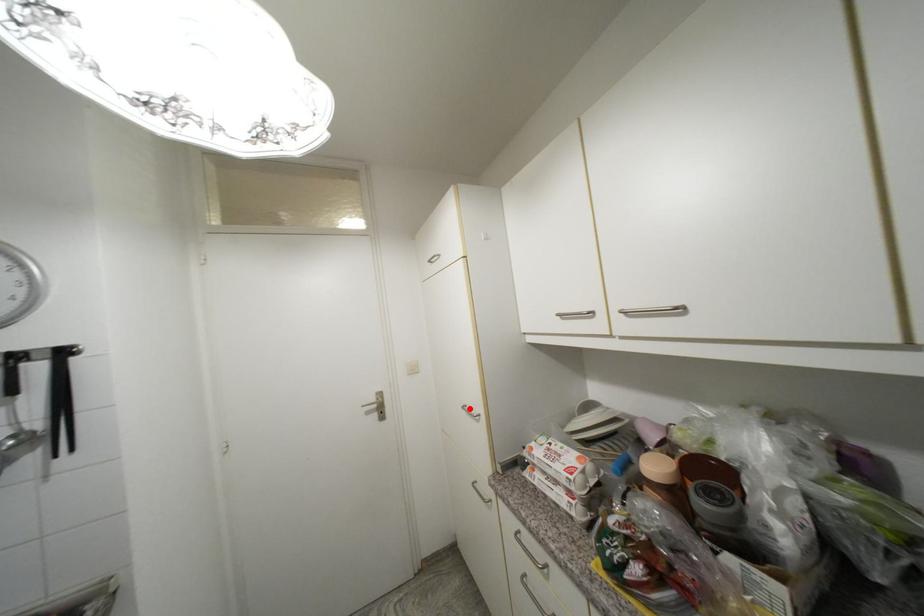
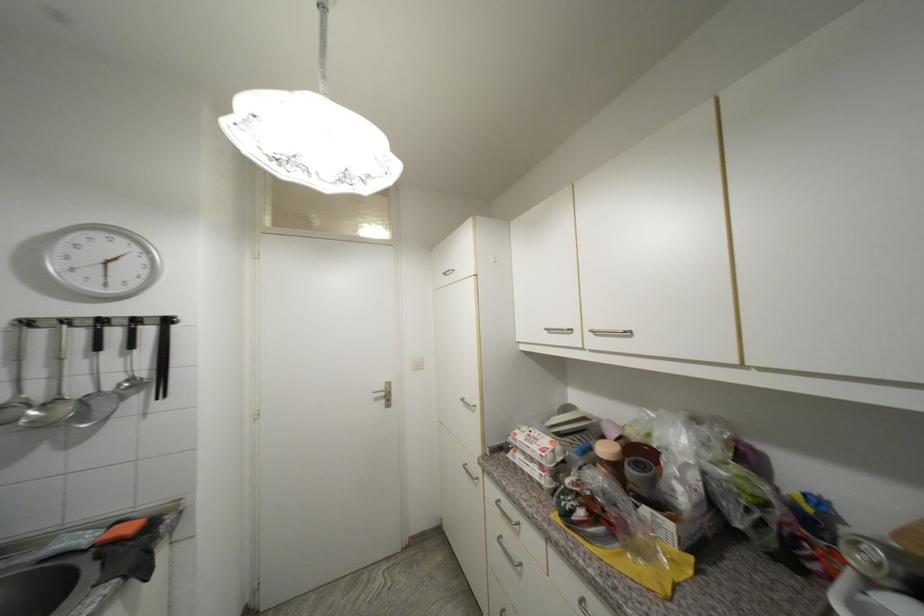
Find the pixel in the second image that matches the highlighted location in the first image.

(468, 400)